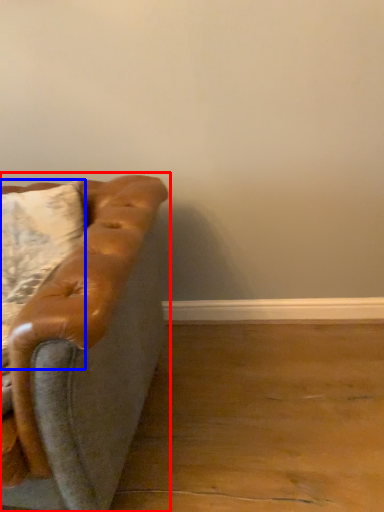
Question: Among these objects, which one is farthest to the camera, studio couch (highlighted by a red box) or pillow (highlighted by a blue box)?

Choices:
 (A) studio couch
 (B) pillow

Answer: (B)